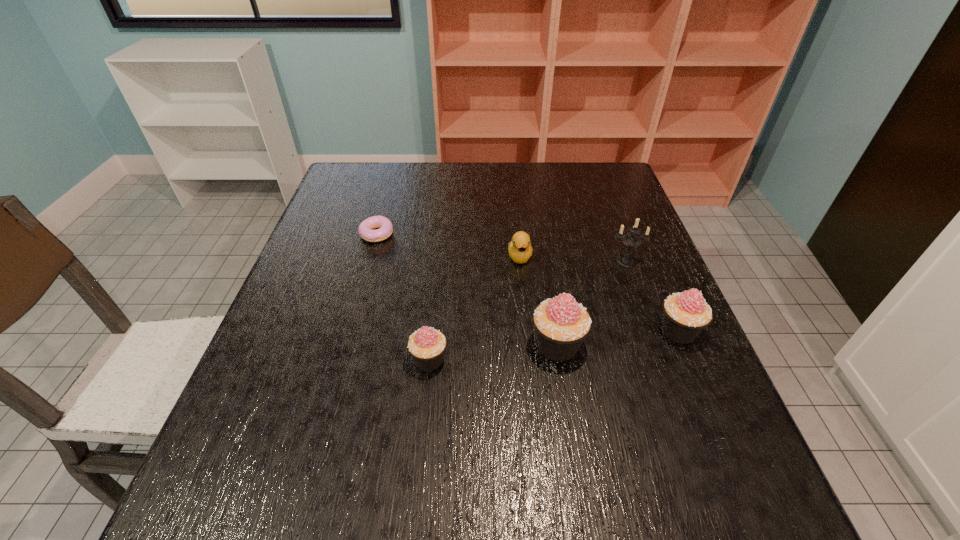
Identify the location of the leftmost cupcake. (427, 345).

This screenshot has height=540, width=960. Find the location of `the third shortest object`. the third shortest object is located at coordinates (427, 345).

Where is `the tallest cupcake`? This screenshot has width=960, height=540. the tallest cupcake is located at coordinates point(561,324).

Locate an element on the screen. This screenshot has width=960, height=540. the second shortest cupcake is located at coordinates (686, 314).

Where is `the shortest object`? The height and width of the screenshot is (540, 960). the shortest object is located at coordinates (365, 229).

Locate an element on the screen. This screenshot has height=540, width=960. doughnut is located at coordinates (365, 229).

This screenshot has height=540, width=960. In order to click on candle holder in this screenshot , I will do `click(631, 240)`.

In order to click on duckling in this screenshot , I will do `click(520, 250)`.

Locate an element on the screen. vacant space situated on the left of the fifth object from right to left is located at coordinates (371, 360).

At what (x,y) coordinates should I click in order to perform the action: click on free space located 0.070m on the back of the tallest cupcake. Please return your answer as a coordinate pair (x, y). The image size is (960, 540). Looking at the image, I should click on (550, 300).